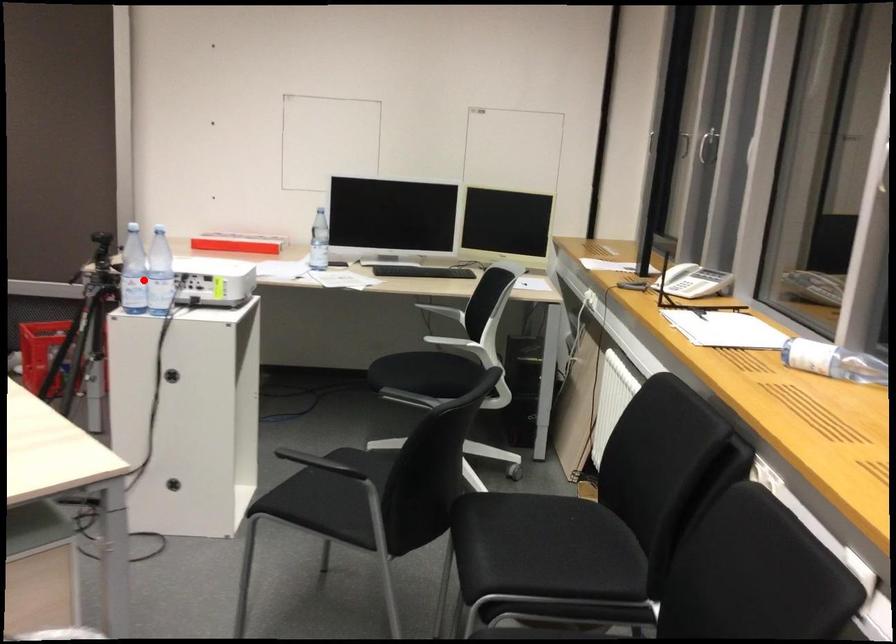
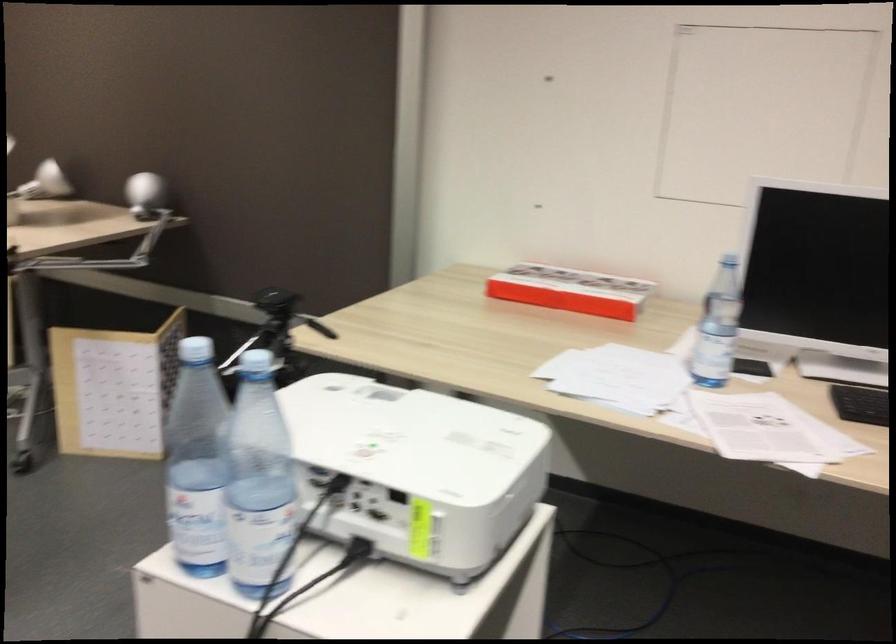
Question: I am providing you with two images of the same scene from different viewpoints. Image1 has a red point marked. In image2, the corresponding 3D location appears at what relative position? Reply with the corresponding letter.

Choices:
 (A) Closer
 (B) Farther

Answer: (A)